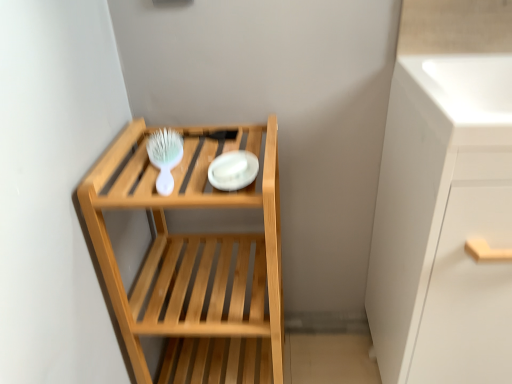
Question: Does white glossy cabinet at right have a larger size compared to white plastic brush at upper left?

Choices:
 (A) yes
 (B) no

Answer: (A)

Question: Can you confirm if white glossy cabinet at right is shorter than white plastic brush at upper left?

Choices:
 (A) no
 (B) yes

Answer: (A)

Question: Can you confirm if white glossy cabinet at right is wider than white plastic brush at upper left?

Choices:
 (A) no
 (B) yes

Answer: (B)

Question: Is white glossy cabinet at right at the left side of white plastic brush at upper left?

Choices:
 (A) no
 (B) yes

Answer: (A)

Question: From a real-world perspective, does white glossy cabinet at right stand above white plastic brush at upper left?

Choices:
 (A) no
 (B) yes

Answer: (A)

Question: Can you confirm if white glossy cabinet at right is smaller than white plastic brush at upper left?

Choices:
 (A) no
 (B) yes

Answer: (A)

Question: Are white plastic brush at upper left and white glossy plate at center located far from each other?

Choices:
 (A) no
 (B) yes

Answer: (A)

Question: Is white glossy plate at center surrounded by white plastic brush at upper left?

Choices:
 (A) no
 (B) yes

Answer: (A)

Question: Can you confirm if white plastic brush at upper left is smaller than white glossy plate at center?

Choices:
 (A) no
 (B) yes

Answer: (A)

Question: Considering the relative positions of white plastic brush at upper left and white glossy plate at center in the image provided, is white plastic brush at upper left to the right of white glossy plate at center from the viewer's perspective?

Choices:
 (A) yes
 (B) no

Answer: (B)

Question: Can you confirm if white plastic brush at upper left is taller than white glossy plate at center?

Choices:
 (A) no
 (B) yes

Answer: (B)

Question: Considering the relative positions of white plastic brush at upper left and white glossy plate at center in the image provided, is white plastic brush at upper left behind white glossy plate at center?

Choices:
 (A) yes
 (B) no

Answer: (A)

Question: From the image's perspective, is white glossy cabinet at right on white glossy sink at upper right?

Choices:
 (A) no
 (B) yes

Answer: (A)